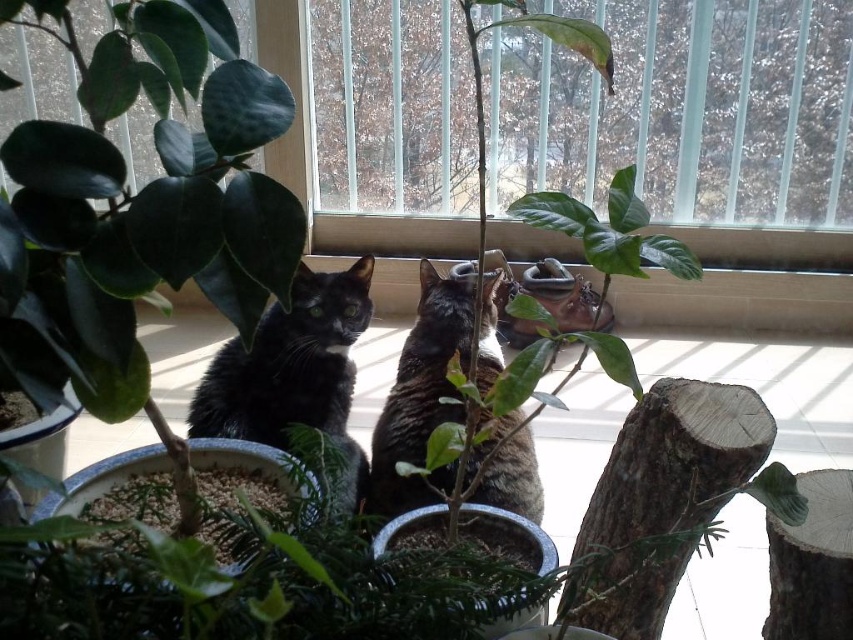
Looking at this image, who is higher up, black glossy cat at center or black fur cat at center?

black fur cat at center

Is black glossy cat at center below black fur cat at center?

Indeed, black glossy cat at center is positioned under black fur cat at center.

This screenshot has height=640, width=853. Describe the element at coordinates (294, 372) in the screenshot. I see `black glossy cat at center` at that location.

This screenshot has height=640, width=853. Find the location of `black glossy cat at center`. black glossy cat at center is located at coordinates (294, 372).

Which of these two, transparent plastic window at center or black fur cat at center, stands shorter?

With less height is black fur cat at center.

Consider the image. Between transparent plastic window at center and black fur cat at center, which one has more height?

transparent plastic window at center is taller.

Which is in front, point (645, 164) or point (436, 486)?

Positioned in front is point (436, 486).

You are a GUI agent. You are given a task and a screenshot of the screen. Output one action in this format:
    pyautogui.click(x=<x>, y=<y>)
    Task: Click on the transparent plastic window at center
    This screenshot has width=853, height=640.
    Given the screenshot: What is the action you would take?
    pyautogui.click(x=682, y=109)

Is transparent plastic window at center bigger than black glossy cat at center?

Yes, transparent plastic window at center is bigger than black glossy cat at center.

Who is shorter, transparent plastic window at center or black glossy cat at center?

black glossy cat at center

Does point (786, 156) come closer to viewer compared to point (221, 376)?

No.

You are a GUI agent. You are given a task and a screenshot of the screen. Output one action in this format:
    pyautogui.click(x=<x>, y=<y>)
    Task: Click on the transparent plastic window at center
    
    Given the screenshot: What is the action you would take?
    pyautogui.click(x=682, y=109)